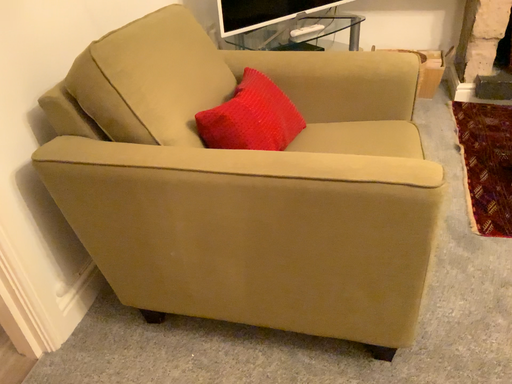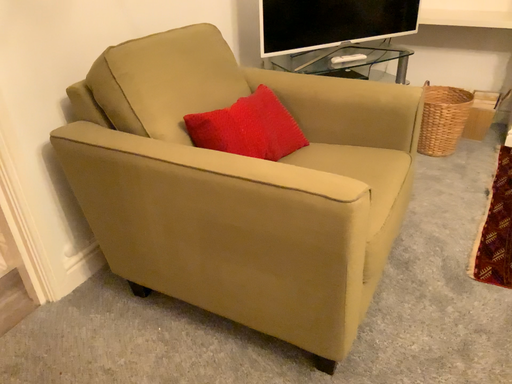
Question: How did the camera likely rotate when shooting the video?

Choices:
 (A) rotated left
 (B) rotated right

Answer: (A)